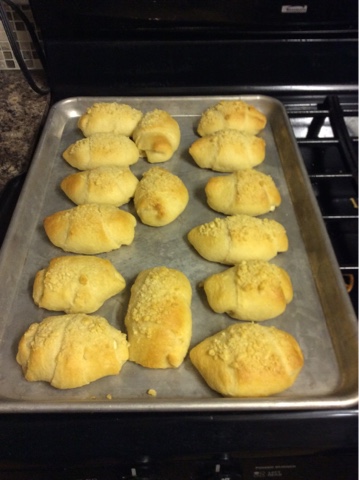
Find the location of a particular element. oven is located at coordinates (334, 181).